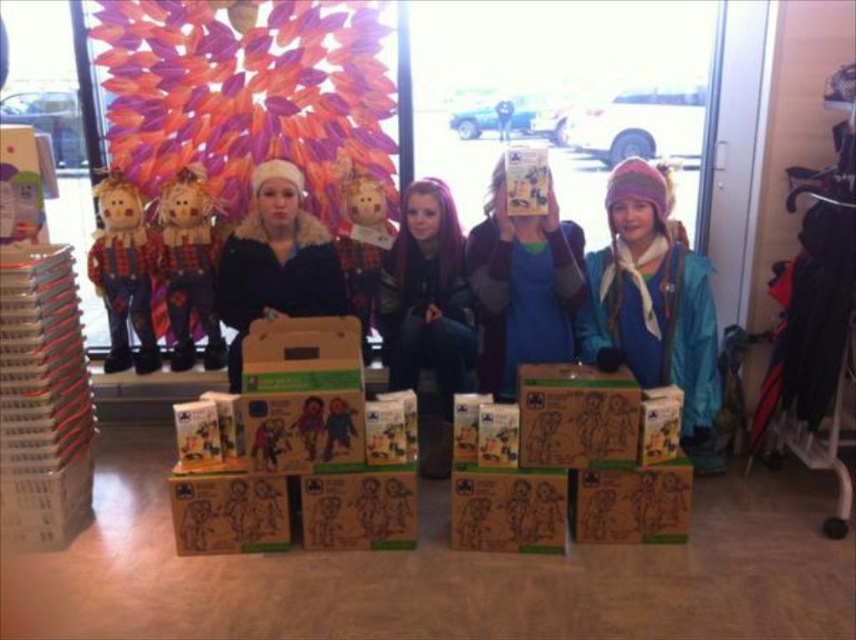
You are standing in the scene and want to place a new item at coordinate point 0.5, 0.75. Is there space available near the blue fleece jacket at center to place it there?

The blue fleece jacket at center is located at point (651, 300), so placing an item at (642, 320) would be very close. However, since the exact dimensions of the jacket and surrounding space aren

You are a photographer trying to capture a clear shot of both the dark purple hair at center and the multicolored fabric scarecrow at left. Since you want to ensure both are visible, which object should you focus on first considering their sizes?

The dark purple hair at center is larger in size than the multicolored fabric scarecrow at left, so you should focus on the dark purple hair at center first to ensure it is in clear focus, then adjust for the smaller multicolored fabric scarecrow at left.